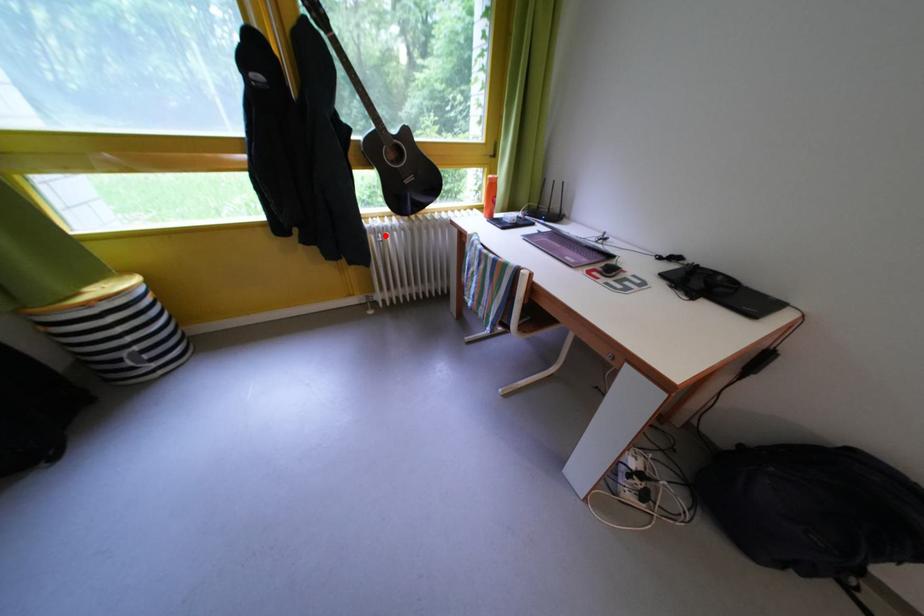
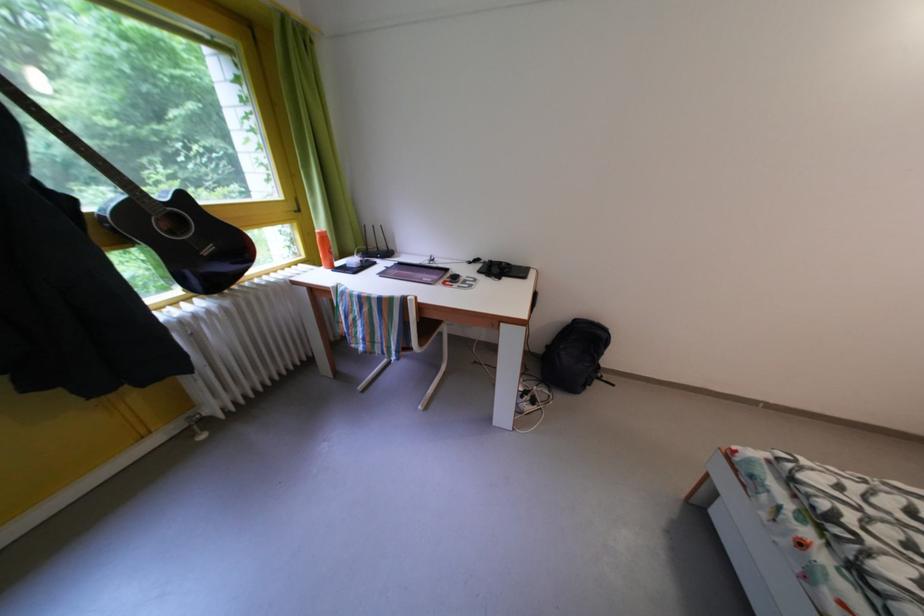
The point at the highlighted location is marked in the first image. Where is the corresponding point in the second image?

(190, 328)